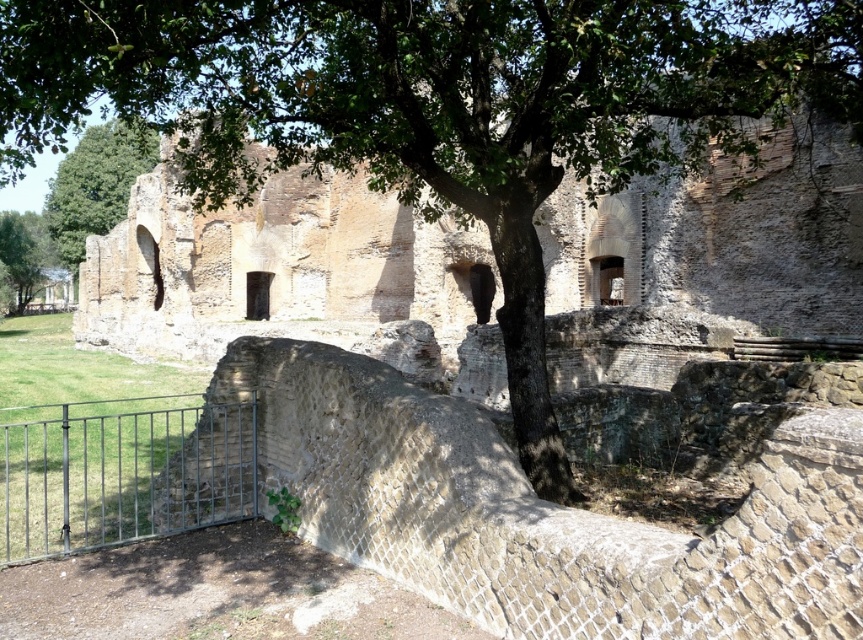
You are a visitor approaching the ancient stone structure and see the metallic gate at lower left and the green leafy tree at lower left. Which object is closer to you?

The metallic gate at lower left is closer to you because it is smaller than the green leafy tree at lower left.

You are an archaeologist examining the ancient stone structure. You notice two green leafy trees in the scene. Which tree, the green leafy tree at upper left or the green leafy tree at lower left, has a larger width?

The green leafy tree at upper left might be wider than the green leafy tree at lower left according to the description.

You are standing at the entrance of the ancient stone structure and notice a green leafy tree at upper left. Can you determine its exact position relative to the structure?

The green leafy tree at upper left is located at point coordinates of (96, 184).